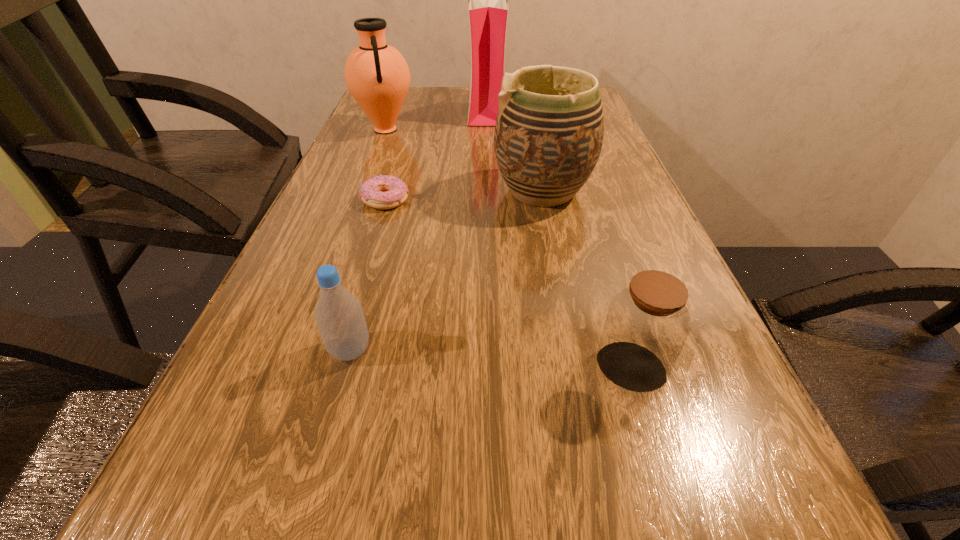
The width and height of the screenshot is (960, 540). I want to click on free spot between the pottery and the pitcher, so click(x=464, y=160).

Find the location of a particular element. The height and width of the screenshot is (540, 960). free space that is in between the pitcher and the tallest object is located at coordinates (436, 119).

Find the location of a particular element. The image size is (960, 540). free space between the tallest object and the bottle is located at coordinates (419, 230).

Point out which object is positioned as the nearest to the shortest object. Please provide its 2D coordinates. Your answer should be formatted as a tuple, i.e. [(x, y)], where the tuple contains the x and y coordinates of a point satisfying the conditions above.

[(549, 131)]

The height and width of the screenshot is (540, 960). Find the location of `object that is the closest one to the bottle`. object that is the closest one to the bottle is located at coordinates (647, 324).

Find the location of a particular element. This screenshot has height=540, width=960. vacant region that satisfies the following two spatial constraints: 1. on the front-facing side of the shopping bag; 2. on the back side of the pottery is located at coordinates (490, 191).

The width and height of the screenshot is (960, 540). Identify the location of vacant space that satisfies the following two spatial constraints: 1. on the front-facing side of the shopping bag; 2. on the left side of the jar. (494, 369).

Locate an element on the screen. Image resolution: width=960 pixels, height=540 pixels. vacant space that satisfies the following two spatial constraints: 1. on the front-facing side of the shopping bag; 2. on the back side of the pottery is located at coordinates (490, 191).

Find the location of a particular element. The height and width of the screenshot is (540, 960). free space that satisfies the following two spatial constraints: 1. on the front-facing side of the tallest object; 2. on the right side of the pottery is located at coordinates (490, 191).

Image resolution: width=960 pixels, height=540 pixels. I want to click on vacant point that satisfies the following two spatial constraints: 1. on the front side of the jar; 2. on the right side of the pitcher, so click(x=296, y=369).